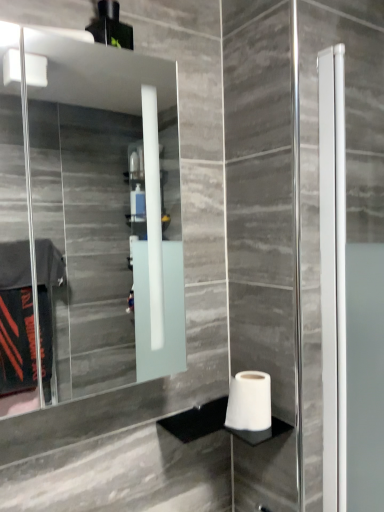
Question: Considering the relative sizes of white matte toilet paper at lower right and clear glass mirror at upper left in the image provided, is white matte toilet paper at lower right taller than clear glass mirror at upper left?

Choices:
 (A) no
 (B) yes

Answer: (A)

Question: From a real-world perspective, is white matte toilet paper at lower right on top of clear glass mirror at upper left?

Choices:
 (A) no
 (B) yes

Answer: (A)

Question: From the image's perspective, is white matte toilet paper at lower right above clear glass mirror at upper left?

Choices:
 (A) no
 (B) yes

Answer: (A)

Question: Does white matte toilet paper at lower right have a larger size compared to clear glass mirror at upper left?

Choices:
 (A) no
 (B) yes

Answer: (A)

Question: Is white matte toilet paper at lower right thinner than clear glass mirror at upper left?

Choices:
 (A) no
 (B) yes

Answer: (B)

Question: Is white matte toilet paper at lower right at the left side of clear glass mirror at upper left?

Choices:
 (A) no
 (B) yes

Answer: (A)

Question: Can you confirm if clear glass mirror at upper left is bigger than white matte toilet paper at lower right?

Choices:
 (A) yes
 (B) no

Answer: (A)

Question: Considering the relative positions of clear glass mirror at upper left and white matte toilet paper at lower right in the image provided, is clear glass mirror at upper left in front of white matte toilet paper at lower right?

Choices:
 (A) yes
 (B) no

Answer: (A)

Question: From a real-world perspective, is clear glass mirror at upper left positioned under white matte toilet paper at lower right based on gravity?

Choices:
 (A) no
 (B) yes

Answer: (A)

Question: Can you confirm if clear glass mirror at upper left is positioned to the left of white matte toilet paper at lower right?

Choices:
 (A) yes
 (B) no

Answer: (A)

Question: From the image's perspective, is clear glass mirror at upper left located beneath white matte toilet paper at lower right?

Choices:
 (A) no
 (B) yes

Answer: (A)

Question: From a real-world perspective, is clear glass mirror at upper left on white matte toilet paper at lower right?

Choices:
 (A) yes
 (B) no

Answer: (A)

Question: From a real-world perspective, relative to white matte toilet paper at lower right, is clear glass mirror at upper left vertically above or below?

Choices:
 (A) below
 (B) above

Answer: (B)